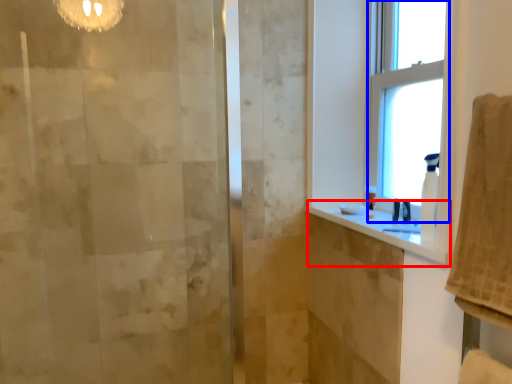
Question: Among these objects, which one is farthest to the camera, counter top (highlighted by a red box) or window (highlighted by a blue box)?

Choices:
 (A) counter top
 (B) window

Answer: (B)